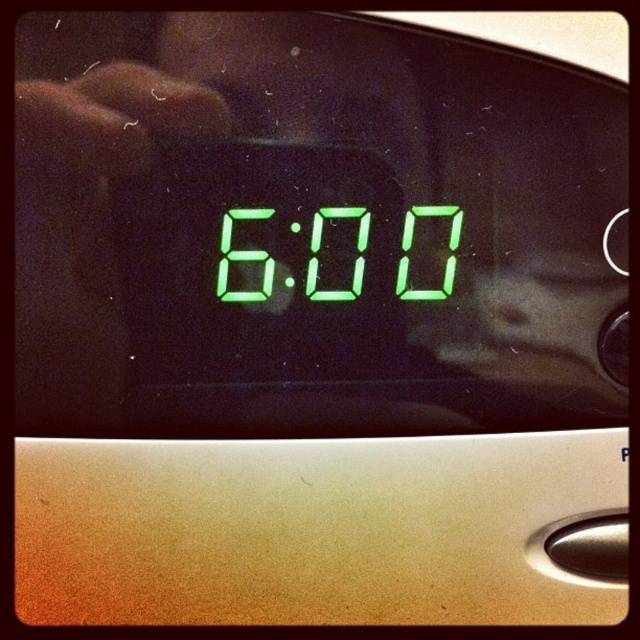
Does point (445, 209) lie behind point (259, 253)?

No, it is in front of (259, 253).

Does green digital clock at center have a lesser height compared to green digital at center?

No, green digital clock at center is not shorter than green digital at center.

What do you see at coordinates (445, 257) in the screenshot? The height and width of the screenshot is (640, 640). I see `green digital clock at center` at bounding box center [445, 257].

Locate an element on the screen. Image resolution: width=640 pixels, height=640 pixels. green digital clock at center is located at coordinates (445, 257).

Between green digital clock at center and green digital display at center, which one has less height?

With less height is green digital clock at center.

Measure the distance between green digital clock at center and camera.

green digital clock at center is 3.93 feet from camera.

In order to click on green digital clock at center in this screenshot , I will do [x=445, y=257].

Does green digital display at center have a lesser width compared to green digital at center?

No, green digital display at center is not thinner than green digital at center.

Which is more to the left, green digital display at center or green digital at center?

green digital at center is more to the left.

Is point (316, 220) closer to viewer compared to point (248, 259)?

No, it is behind (248, 259).

Image resolution: width=640 pixels, height=640 pixels. Identify the location of green digital display at center. (353, 259).